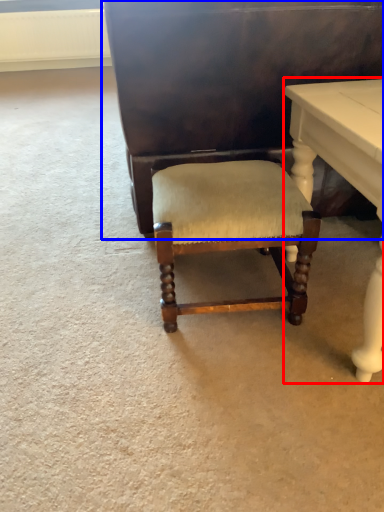
Question: Which object appears farthest to the camera in this image, table (highlighted by a red box) or vanity (highlighted by a blue box)?

Choices:
 (A) table
 (B) vanity

Answer: (B)